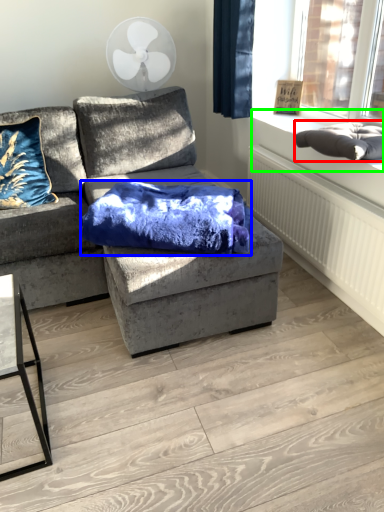
Question: Which is farther away from material (highlighted by a red box)? blanket (highlighted by a blue box) or window sill (highlighted by a green box)?

Choices:
 (A) blanket
 (B) window sill

Answer: (A)